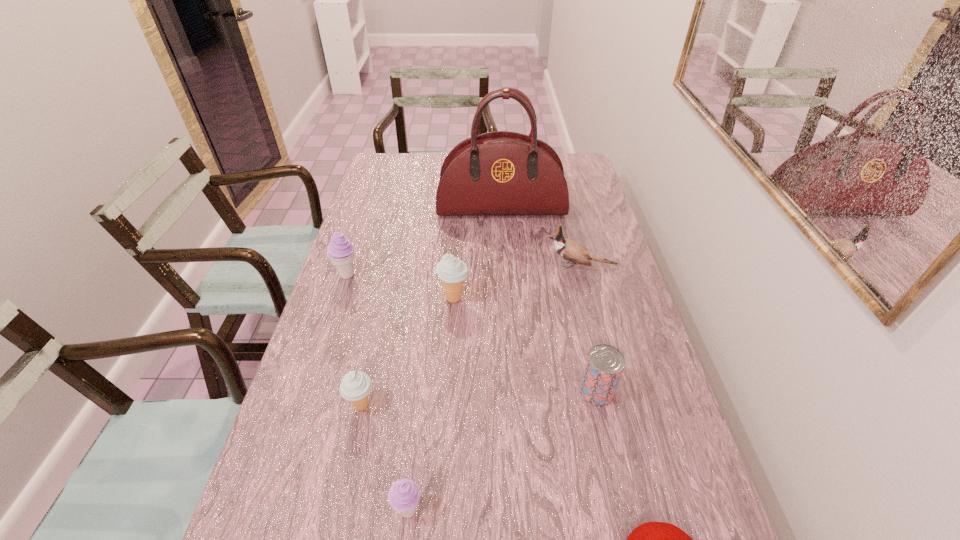
Find the location of `the third closest icecream to the seventh object from right to left`. the third closest icecream to the seventh object from right to left is located at coordinates (340, 251).

This screenshot has height=540, width=960. Find the location of `vacant space that satisfies the following two spatial constraints: 1. on the front-facing side of the farthest object; 2. on the left side of the red beer can`. vacant space that satisfies the following two spatial constraints: 1. on the front-facing side of the farthest object; 2. on the left side of the red beer can is located at coordinates (513, 391).

Identify the location of free space that satisfies the following two spatial constraints: 1. at the face of the bird; 2. on the front side of the third icecream from right to left. The height and width of the screenshot is (540, 960). (615, 406).